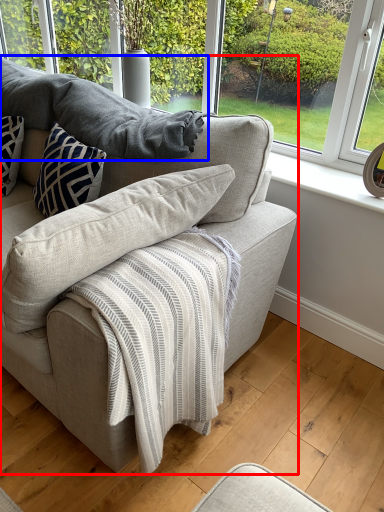
Question: Which object is further to the camera taking this photo, studio couch (highlighted by a red box) or gray (highlighted by a blue box)?

Choices:
 (A) studio couch
 (B) gray

Answer: (B)